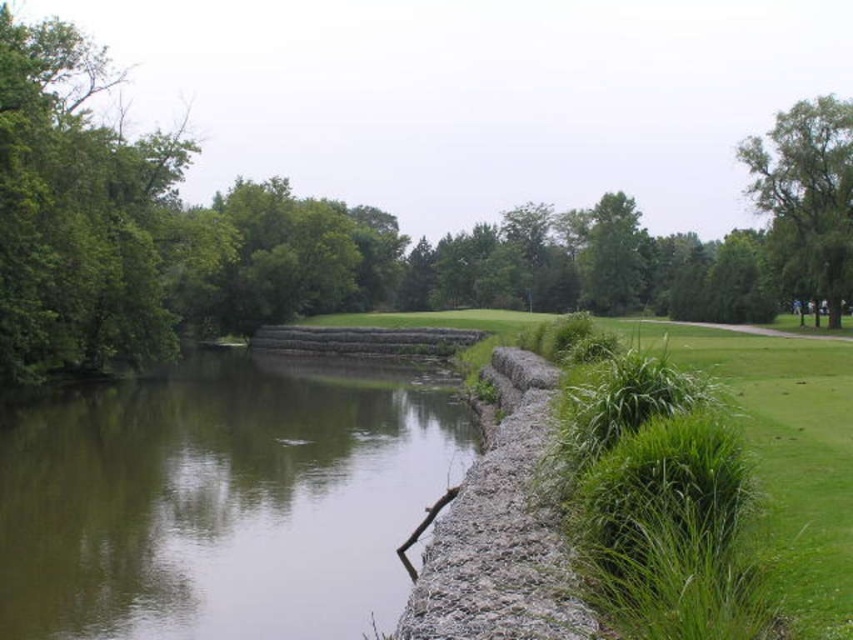
Question: Estimate the real-world distances between objects in this image. Which object is closer to the green leafy tree at upper left?

Choices:
 (A) green leafy tree at upper right
 (B) green concrete river at lower left
 (C) green leafy tree at upper center

Answer: (C)

Question: Which of these objects is positioned farthest from the green leafy tree at upper left?

Choices:
 (A) green leafy tree at upper center
 (B) green concrete river at lower left
 (C) green leafy tree at upper right

Answer: (C)

Question: Is green leafy tree at upper left above green concrete river at lower left?

Choices:
 (A) no
 (B) yes

Answer: (B)

Question: Can you confirm if green leafy tree at upper left is bigger than green concrete river at lower left?

Choices:
 (A) no
 (B) yes

Answer: (B)

Question: Is green leafy tree at upper left to the right of green leafy tree at upper right from the viewer's perspective?

Choices:
 (A) no
 (B) yes

Answer: (A)

Question: Estimate the real-world distances between objects in this image. Which object is farther from the green leafy tree at upper right?

Choices:
 (A) green concrete river at lower left
 (B) green leafy tree at upper center

Answer: (B)